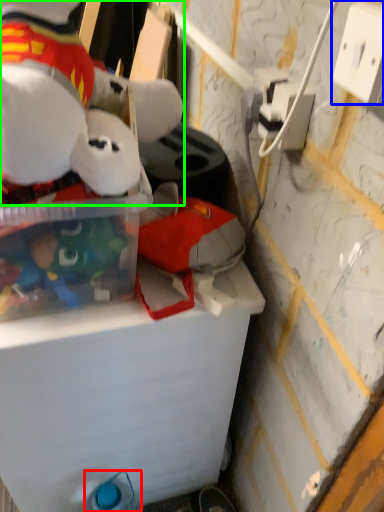
Question: Which object is the farthest from bottle (highlighted by a red box)? Choose among these: power outlet (highlighted by a blue box) or toy (highlighted by a green box).

Choices:
 (A) power outlet
 (B) toy

Answer: (A)